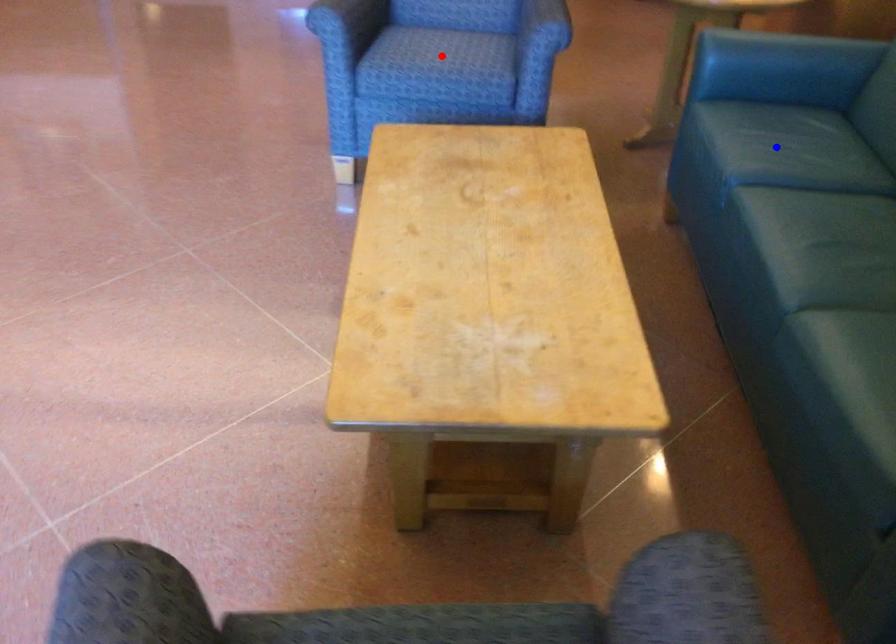
Question: In the image, two points are highlighted. Which point is nearer to the camera? Reply with the corresponding letter.

Choices:
 (A) blue point
 (B) red point

Answer: (A)